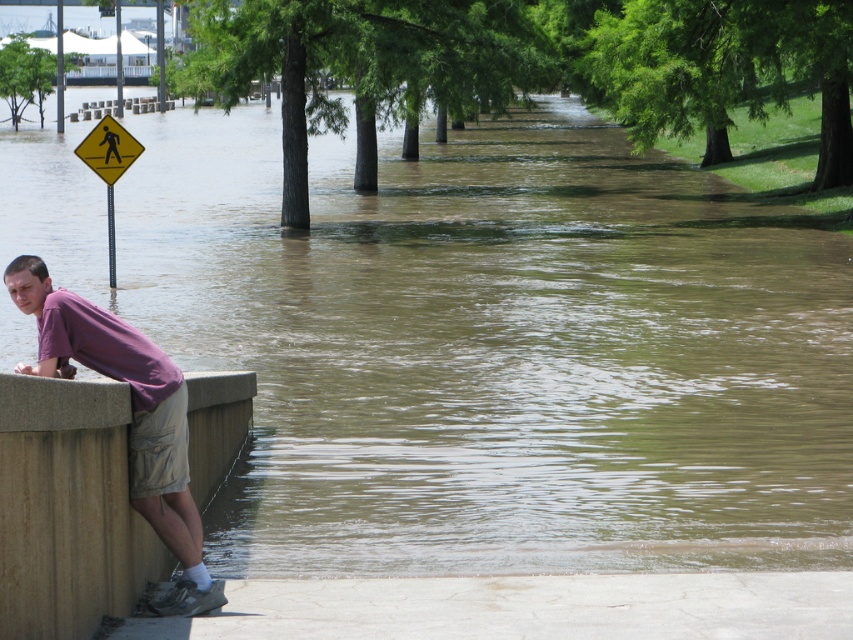
Does purple cotton shirt at lower left have a smaller size compared to yellow diamond at left?

Indeed, purple cotton shirt at lower left has a smaller size compared to yellow diamond at left.

Does point (154, 376) come farther from viewer compared to point (113, 180)?

No, (154, 376) is in front of (113, 180).

You are a GUI agent. You are given a task and a screenshot of the screen. Output one action in this format:
    pyautogui.click(x=<x>, y=<y>)
    Task: Click on the purple cotton shirt at lower left
    The width and height of the screenshot is (853, 640).
    Given the screenshot: What is the action you would take?
    pyautogui.click(x=131, y=417)

Locate an element on the screen. This screenshot has height=640, width=853. purple cotton shirt at lower left is located at coordinates (131, 417).

Which is behind, point (76, 336) or point (125, 156)?

The point (125, 156) is more distant.

At what (x,y) coordinates should I click in order to perform the action: click on purple cotton shirt at lower left. Please return your answer as a coordinate pair (x, y). Looking at the image, I should click on (131, 417).

Identify the location of purple cotton shirt at lower left. Image resolution: width=853 pixels, height=640 pixels. (131, 417).

Is point (107, 152) positioned behind point (96, 138)?

Yes.

Is yellow diamond-shaped sign at left taller than yellow diamond at left?

Correct, yellow diamond-shaped sign at left is much taller as yellow diamond at left.

Who is more distant from viewer, (80,148) or (114,140)?

Positioned behind is point (114,140).

Where is `yellow diamond-shaped sign at left`? The image size is (853, 640). yellow diamond-shaped sign at left is located at coordinates (108, 166).